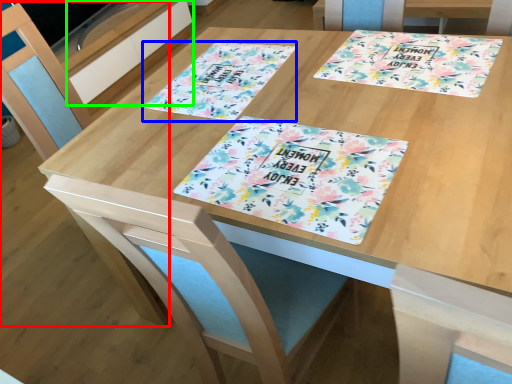
Question: Estimate the real-world distances between objects in this image. Which object is closer to chair (highlighted by a red box), flyer (highlighted by a blue box) or drawer (highlighted by a green box)?

Choices:
 (A) flyer
 (B) drawer

Answer: (A)